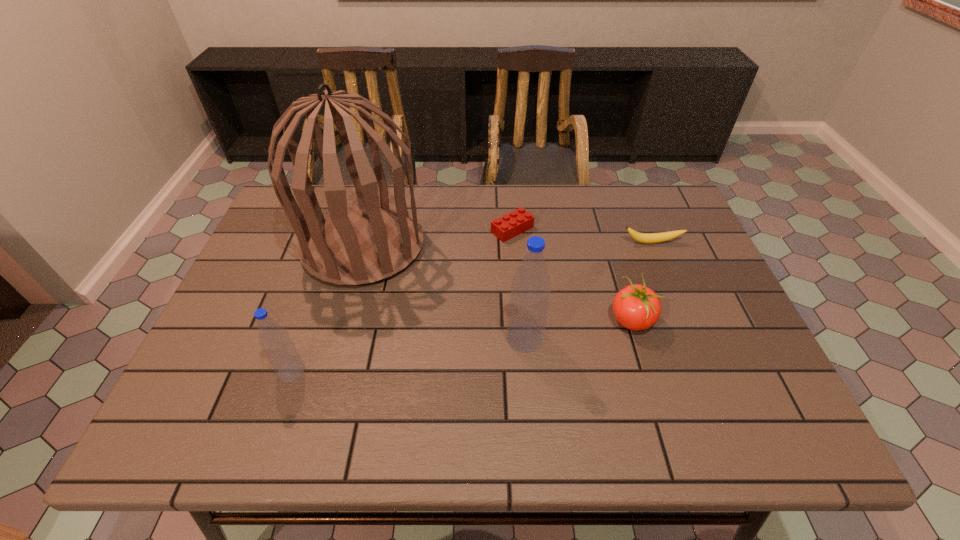
Image resolution: width=960 pixels, height=540 pixels. In order to click on vacant space situated 0.350m on the front of the Lego in this screenshot , I will do tap(521, 343).

Locate an element on the screen. vacant space situated 0.290m on the front of the tallest object is located at coordinates (324, 391).

This screenshot has height=540, width=960. Find the location of `vacant area situated 0.090m on the upward curve of the fifth tallest object`. vacant area situated 0.090m on the upward curve of the fifth tallest object is located at coordinates (662, 268).

Locate an element on the screen. This screenshot has width=960, height=540. blank space located on the back of the fourth tallest object is located at coordinates (599, 213).

Where is `Lego at the far edge`? Lego at the far edge is located at coordinates (510, 225).

At what (x,y) coordinates should I click in order to perform the action: click on birdcage positioned at the far edge. Please return your answer as a coordinate pair (x, y). Looking at the image, I should click on (359, 244).

The width and height of the screenshot is (960, 540). Find the location of `object located at the near edge`. object located at the near edge is located at coordinates (280, 350).

The height and width of the screenshot is (540, 960). In order to click on object situated at the left edge in this screenshot , I will do `click(359, 244)`.

At what (x,y) coordinates should I click in order to perform the action: click on object that is positioned at the right edge. Please return your answer as a coordinate pair (x, y). Looking at the image, I should click on (647, 238).

I want to click on object located at the far left corner, so tap(359, 244).